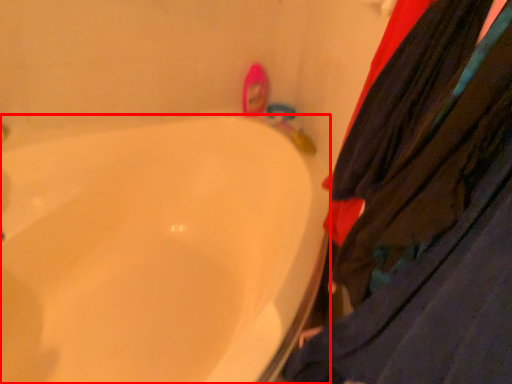
Question: From the image's perspective, where is bathtub (annotated by the red box) located relative to clothing?

Choices:
 (A) below
 (B) above

Answer: (A)